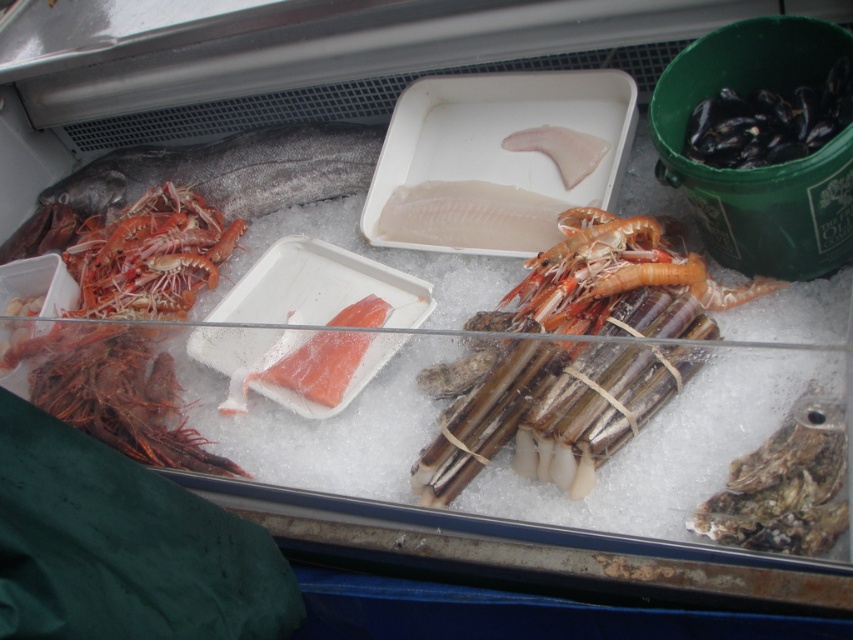
Question: Is the position of dark gray/silver fish at left more distant than that of shiny orange prawns at left?

Choices:
 (A) no
 (B) yes

Answer: (B)

Question: Where is dark gray/silver fish at left located in relation to shiny orange prawns at left in the image?

Choices:
 (A) left
 (B) right

Answer: (B)

Question: Which of the following is the farthest from the observer?

Choices:
 (A) (548, 413)
 (B) (268, 188)

Answer: (B)

Question: Among these points, which one is farthest from the camera?

Choices:
 (A) (434, 483)
 (B) (241, 202)
 (C) (213, 225)

Answer: (B)

Question: Is dark gray/silver fish at left smaller than shiny orange prawns at left?

Choices:
 (A) yes
 (B) no

Answer: (B)

Question: Estimate the real-world distances between objects in this image. Which object is closer to the dark gray/silver fish at left?

Choices:
 (A) shiny orange prawns at left
 (B) shiny orange shrimp at center

Answer: (A)